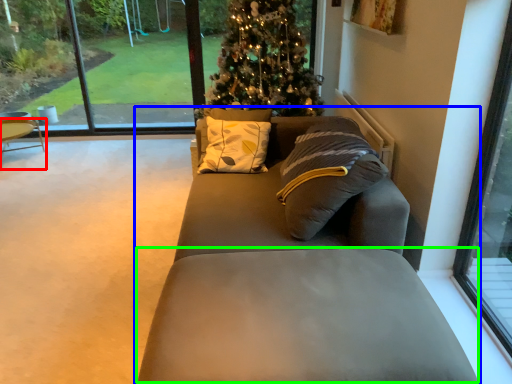
Question: Based on their relative distances, which object is nearer to chair (highlighted by a red box)? Choose from studio couch (highlighted by a blue box) and footrest (highlighted by a green box).

Choices:
 (A) studio couch
 (B) footrest

Answer: (A)